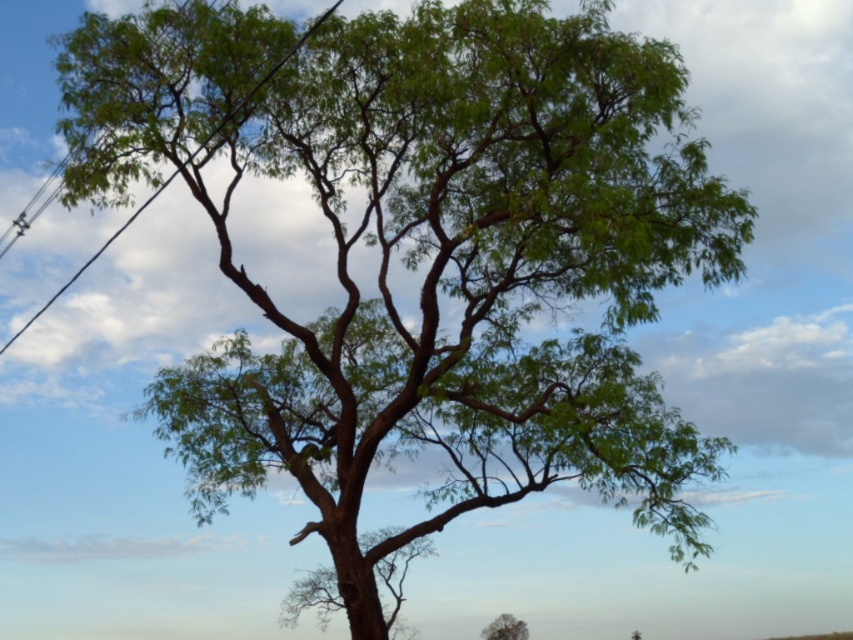
Question: Does black wire at upper left appear under green leafy tree at center?

Choices:
 (A) no
 (B) yes

Answer: (A)

Question: Does black wire at upper left appear under green leafy tree at center?

Choices:
 (A) no
 (B) yes

Answer: (A)

Question: Among these points, which one is nearest to the camera?

Choices:
 (A) (134, 220)
 (B) (486, 630)

Answer: (A)

Question: Can you confirm if black wire at upper left is positioned to the right of green leafy tree at center?

Choices:
 (A) yes
 (B) no

Answer: (B)

Question: Which of the following is the closest to the observer?

Choices:
 (A) green leafy tree at center
 (B) black wire at upper left

Answer: (B)

Question: Among these objects, which one is nearest to the camera?

Choices:
 (A) green leafy tree at center
 (B) black wire at upper left

Answer: (B)